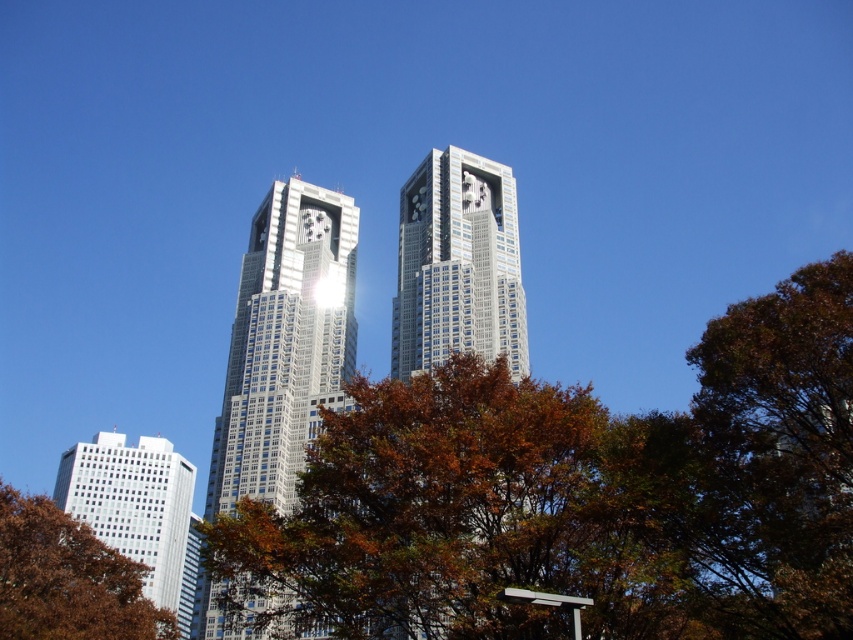
Question: Which point is closer to the camera taking this photo?

Choices:
 (A) (503, 177)
 (B) (621, 636)
 (C) (262, 275)
 (D) (24, 541)

Answer: (B)

Question: Which point is farther from the camera taking this photo?

Choices:
 (A) (144, 620)
 (B) (635, 580)
 (C) (341, 236)
 (D) (486, 179)

Answer: (C)

Question: Observing the image, what is the correct spatial positioning of silver glass skyscraper at center in reference to brown leafy tree at lower left?

Choices:
 (A) above
 (B) below

Answer: (A)

Question: Which point appears farthest from the camera in this image?

Choices:
 (A) (749, 358)
 (B) (267, 356)
 (C) (492, 275)
 (D) (21, 628)

Answer: (B)

Question: Does brown leafy tree at center appear over silver glass skyscraper at center?

Choices:
 (A) no
 (B) yes

Answer: (A)

Question: Can you confirm if brown leafy tree at center is positioned to the left of reflective glass skyscraper at center?

Choices:
 (A) no
 (B) yes

Answer: (A)